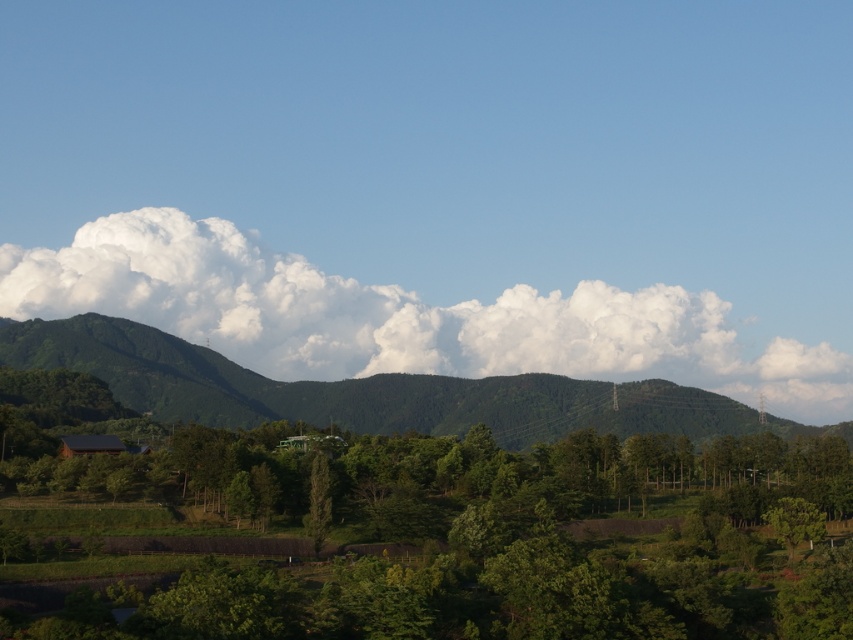
Question: Which point is closer to the camera?

Choices:
 (A) green textured tree at center
 (B) white fluffy cloud at upper center

Answer: (A)

Question: Which point is closer to the camera taking this photo?

Choices:
 (A) (677, 369)
 (B) (312, 520)

Answer: (B)

Question: Is white fluffy cloud at upper center above green textured tree at center?

Choices:
 (A) yes
 (B) no

Answer: (A)

Question: Where is white fluffy cloud at upper center located in relation to green textured tree at center in the image?

Choices:
 (A) above
 (B) below

Answer: (A)

Question: Does white fluffy cloud at upper center have a larger size compared to green textured tree at center?

Choices:
 (A) yes
 (B) no

Answer: (A)

Question: Which point appears closest to the camera in this image?

Choices:
 (A) (329, 506)
 (B) (451, 349)

Answer: (A)